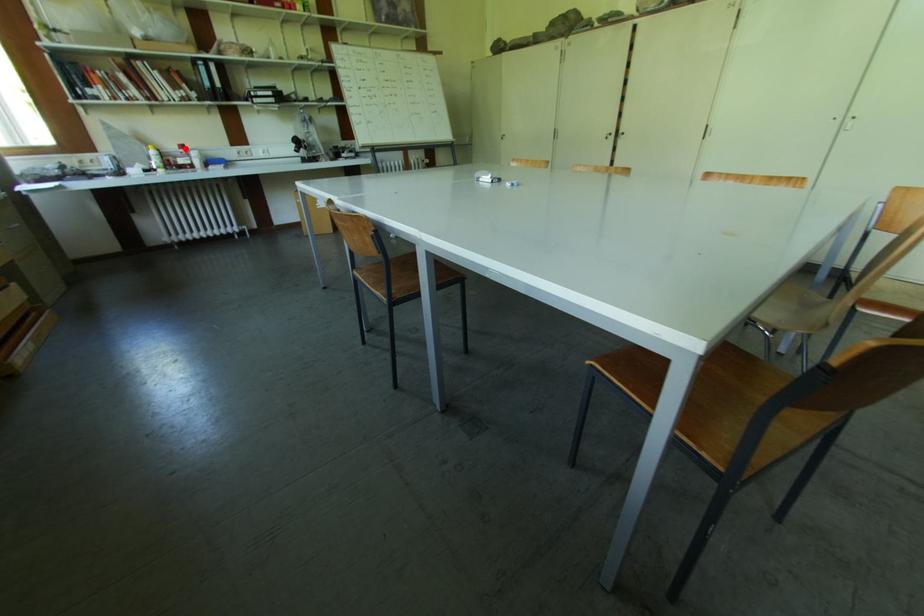
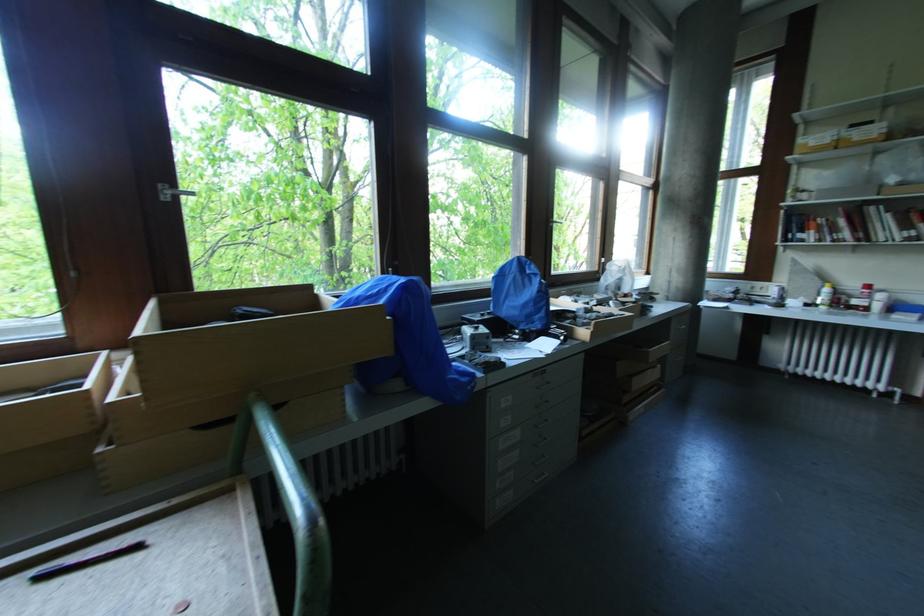
Find the pixel in the second image that matches the highlighted location in the first image.

(871, 288)